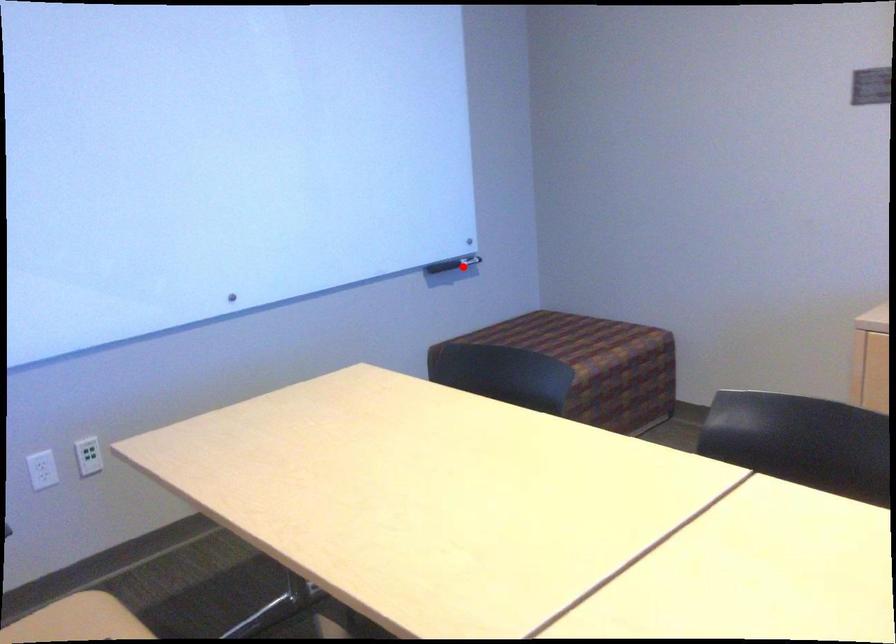
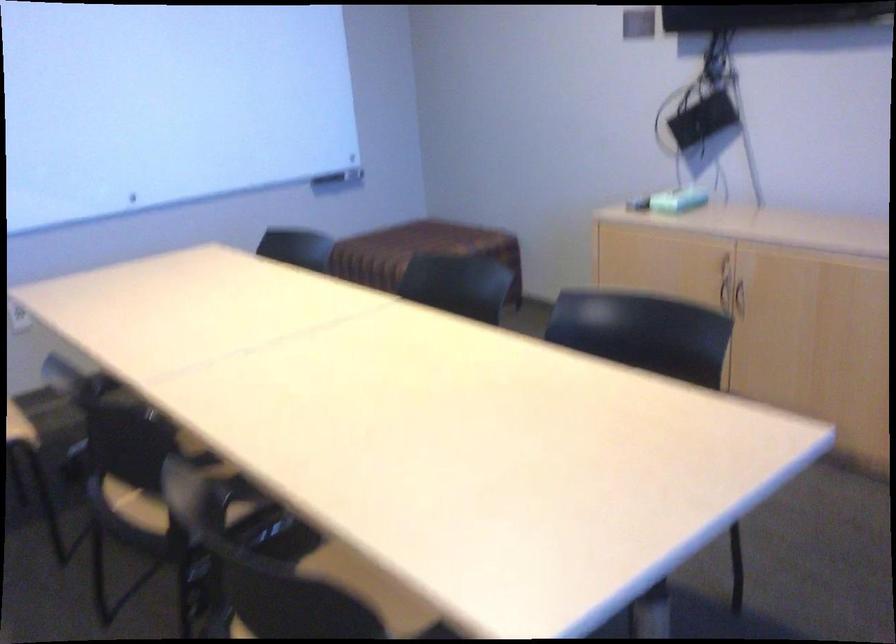
Find the pixel in the second image that matches the highlighted location in the first image.

(339, 178)